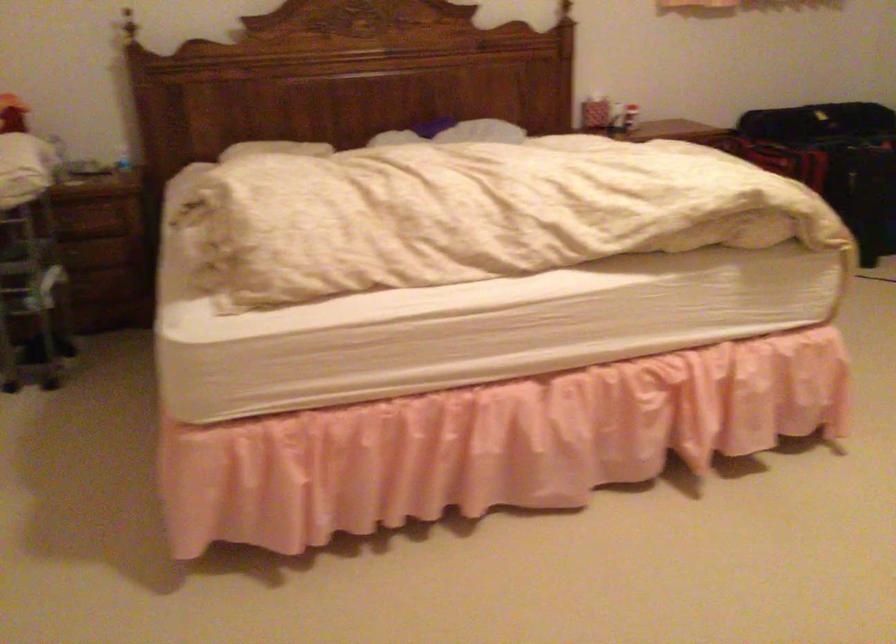
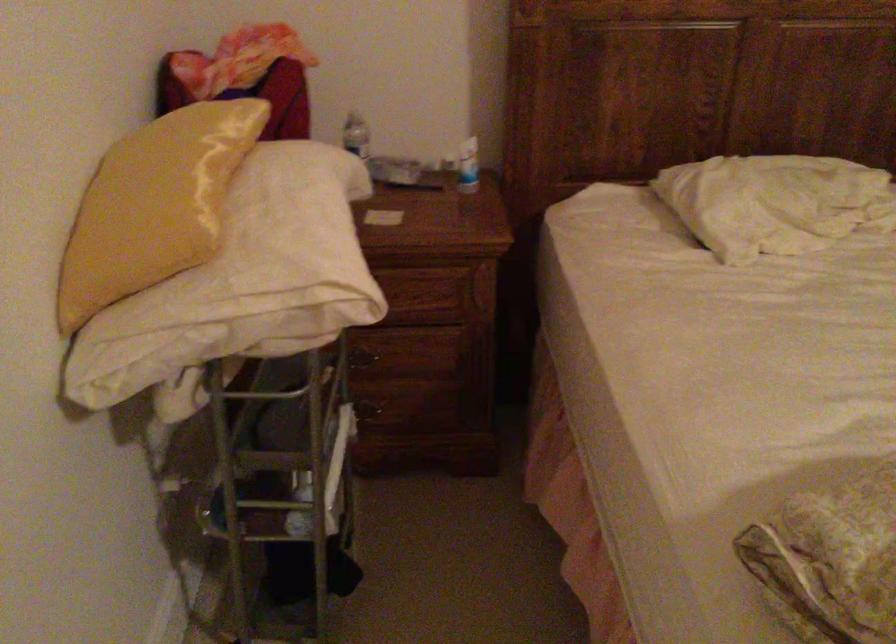
In the second image, find the point that corresponds to the point at 122,144 in the first image.

(468, 166)